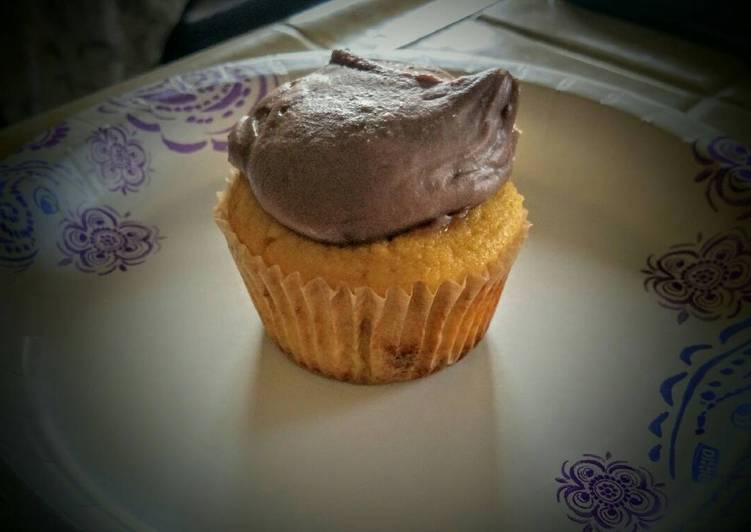
Find the location of a particular element. lines in the tiles is located at coordinates (x=632, y=66), (x=689, y=103).